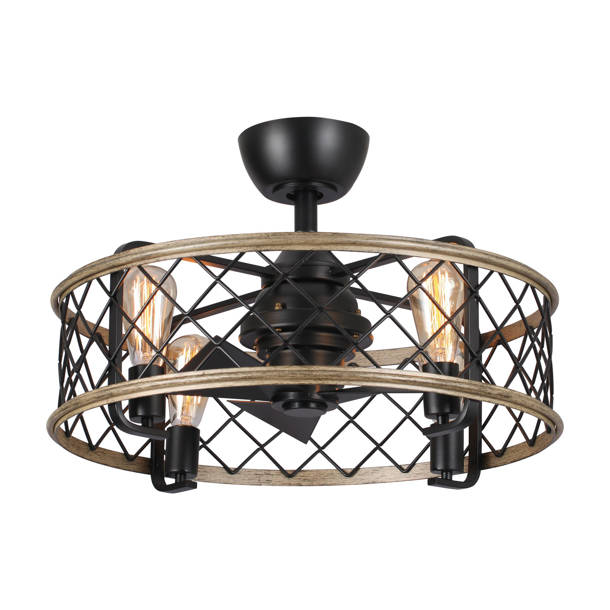
I want to click on base of lightbulb, so click(149, 412), click(185, 449), click(435, 407), click(443, 451).